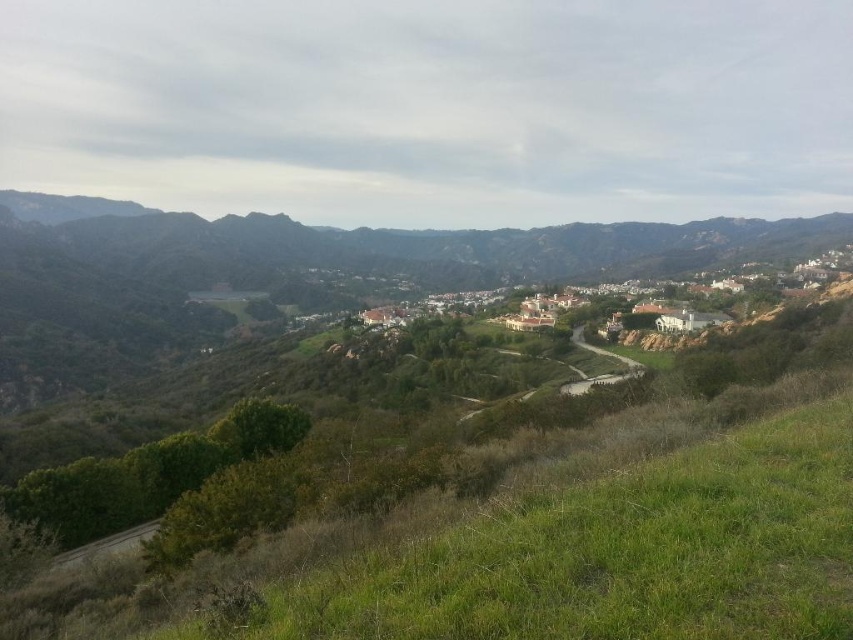
Question: Can you confirm if green grassy hillside at center is smaller than white stucco houses at center?

Choices:
 (A) no
 (B) yes

Answer: (A)

Question: Which point is closer to the camera taking this photo?

Choices:
 (A) (479, 230)
 (B) (727, 284)

Answer: (B)

Question: From the image, what is the correct spatial relationship of green grassy hillside at center in relation to white stucco houses at center?

Choices:
 (A) right
 (B) left

Answer: (B)

Question: Which point is closer to the camera?

Choices:
 (A) white stucco houses at center
 (B) green grassy hillside at center

Answer: (A)

Question: Can you confirm if green grassy hillside at center is positioned to the right of white stucco houses at center?

Choices:
 (A) no
 (B) yes

Answer: (A)